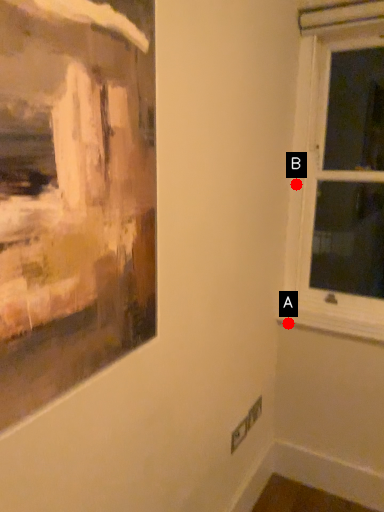
Question: Two points are circled on the image, labeled by A and B beside each circle. Which point is closer to the camera?

Choices:
 (A) A is closer
 (B) B is closer

Answer: (B)